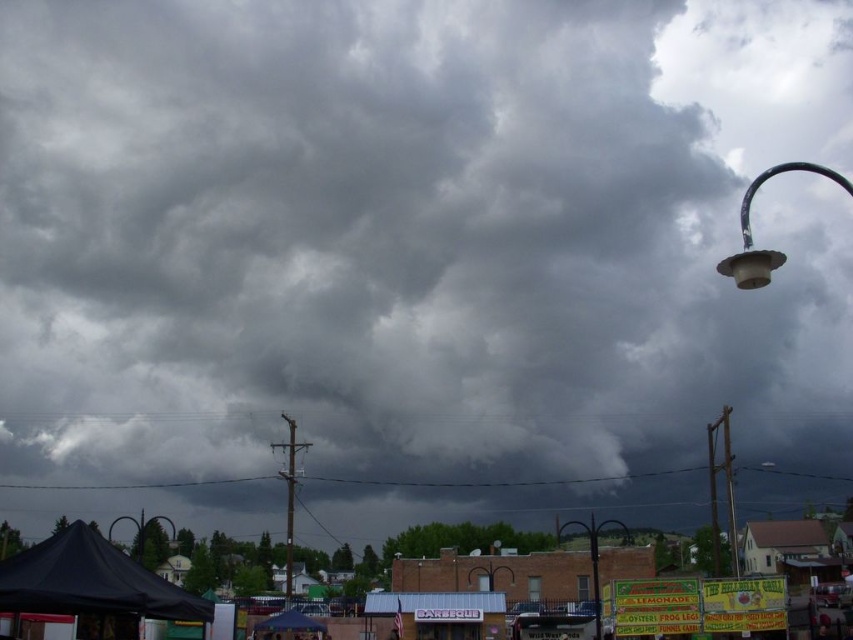
Question: Estimate the real-world distances between objects in this image. Which object is closer to the metallic pole at right?

Choices:
 (A) metallic streetlight at center
 (B) matte plastic street light at upper right
 (C) matte black street light at lower left

Answer: (A)

Question: Does metallic streetlight at center have a greater width compared to metallic pole at right?

Choices:
 (A) no
 (B) yes

Answer: (A)

Question: Which point is farther from the camera taking this photo?

Choices:
 (A) (616, 520)
 (B) (142, 554)
 (C) (750, 284)
 (D) (726, 502)

Answer: (A)

Question: Does metallic streetlight at center have a lesser width compared to matte black street light at lower left?

Choices:
 (A) yes
 (B) no

Answer: (A)

Question: Is metallic streetlight at center positioned behind metallic pole at right?

Choices:
 (A) no
 (B) yes

Answer: (A)

Question: Which point is farther to the camera?

Choices:
 (A) (730, 556)
 (B) (802, 170)
 (C) (595, 534)
 (D) (144, 540)

Answer: (B)